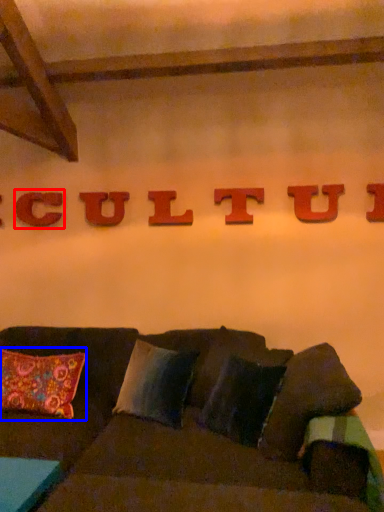
Question: Which object appears farthest to the camera in this image, letter (highlighted by a red box) or pillow (highlighted by a blue box)?

Choices:
 (A) letter
 (B) pillow

Answer: (A)